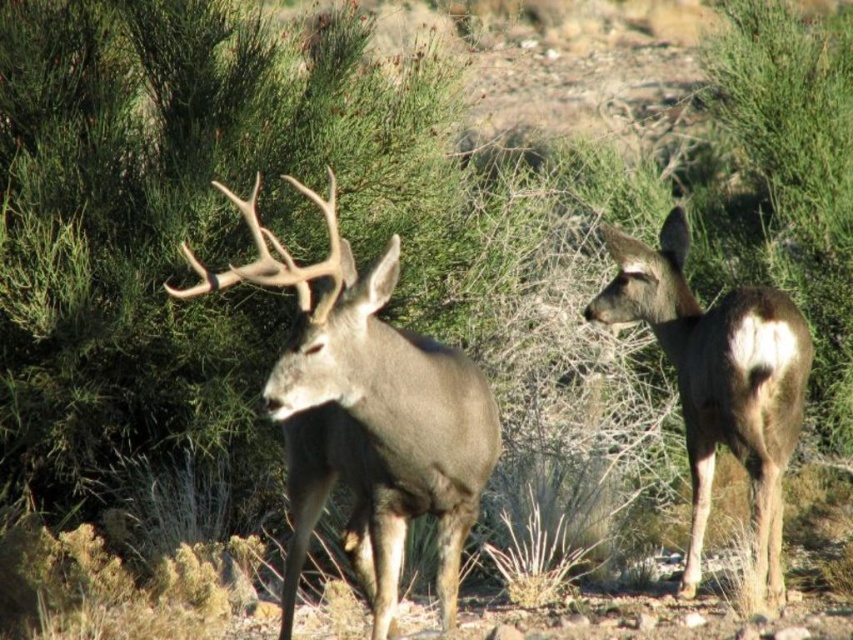
From the picture: Can you confirm if brown velvet deer at center is taller than brown fur deer at right?

In fact, brown velvet deer at center may be shorter than brown fur deer at right.

Does brown velvet deer at center have a lesser height compared to brown fur deer at right?

Yes.

Where is `brown velvet deer at center`? brown velvet deer at center is located at coordinates (367, 416).